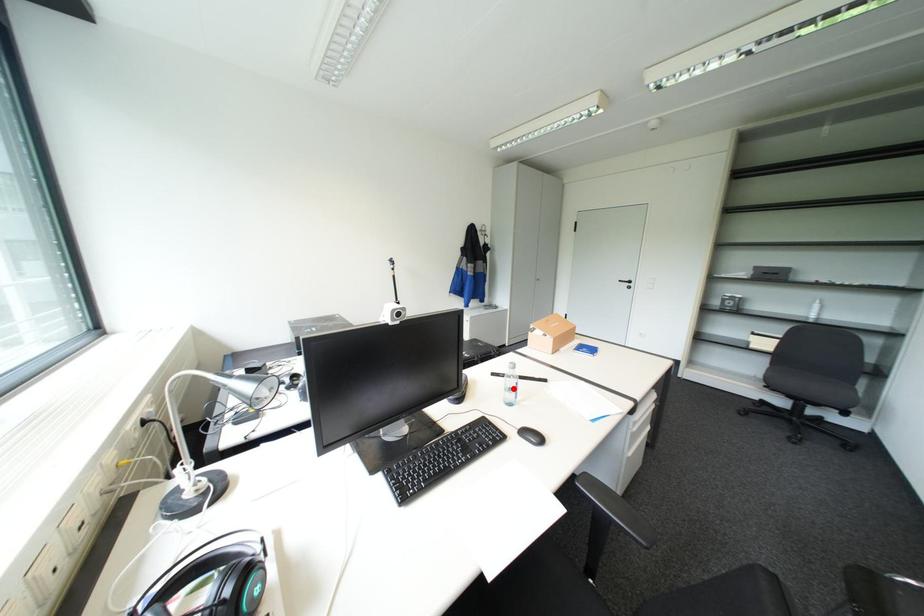
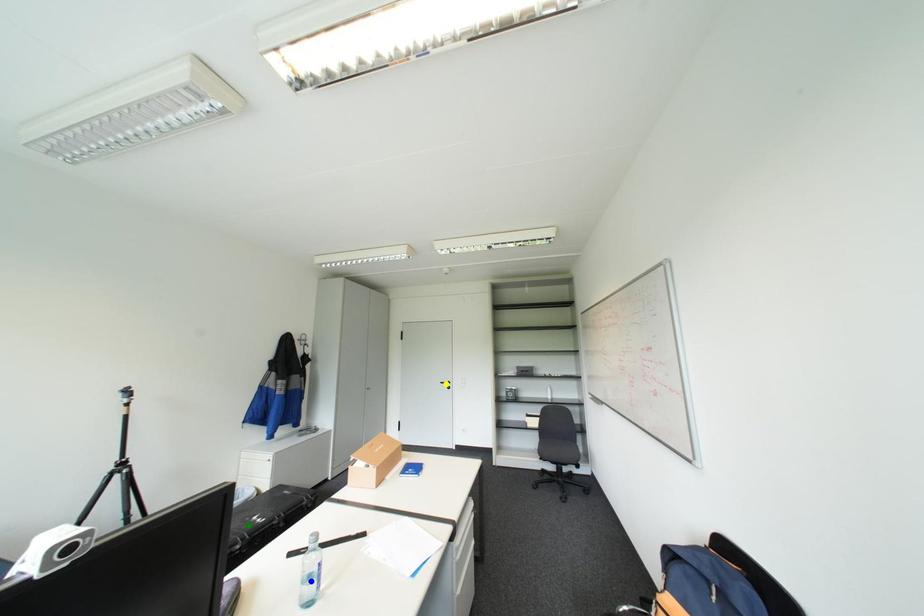
Question: I am providing you with two images of the same scene from different viewpoints. A red point is marked on the first image. You are given multiple points on the second image. Which point in image 2 is actually the same real-world point as the red point in image 1?

Choices:
 (A) green point
 (B) yellow point
 (C) blue point

Answer: (C)